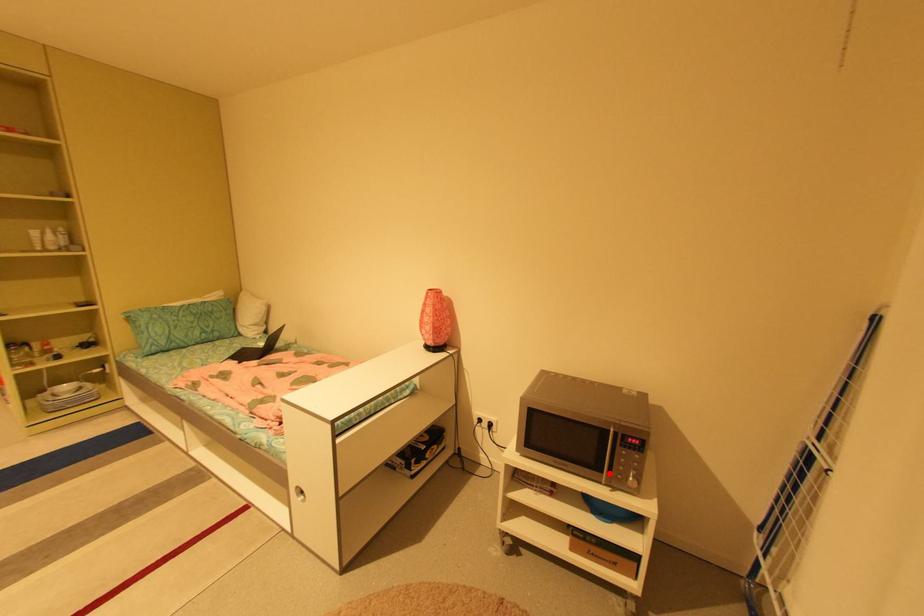
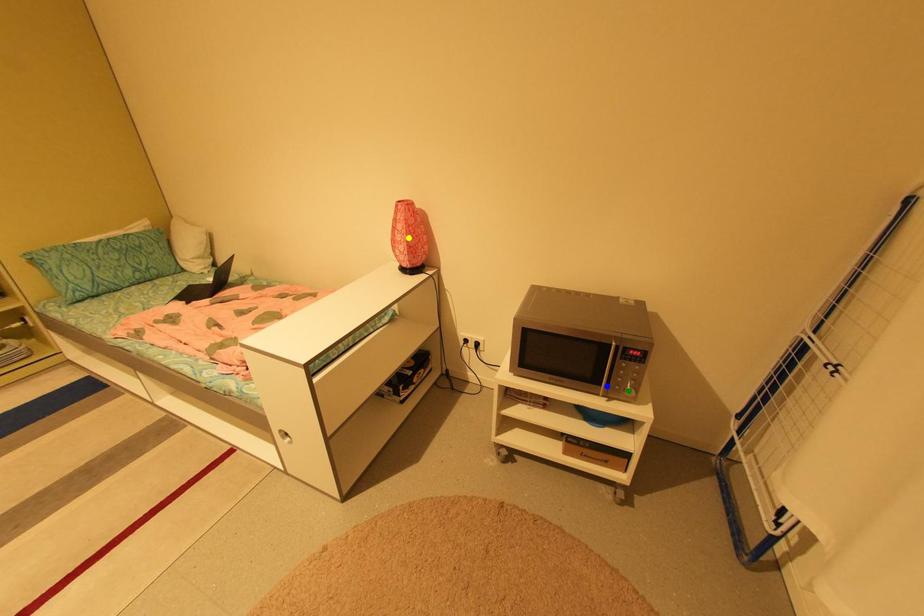
Question: I am providing you with two images of the same scene from different viewpoints. A red point is marked on the first image. You are given multiple points on the second image. Which spot in image 2 lines up with the point in image 1?

Choices:
 (A) blue point
 (B) green point
 (C) yellow point

Answer: (A)